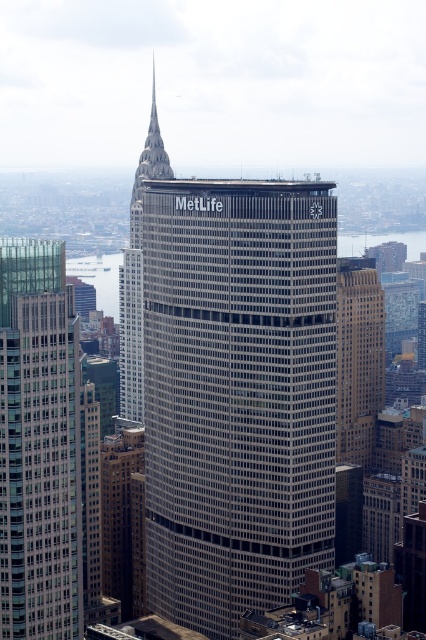
Question: Which object is positioned farthest from the gray glass building at center?

Choices:
 (A) brown stone building at center
 (B) glassy reflective skyscraper at left

Answer: (B)

Question: Does gray glass building at center have a larger size compared to glassy reflective skyscraper at left?

Choices:
 (A) yes
 (B) no

Answer: (A)

Question: Which point is closer to the camera taking this photo?

Choices:
 (A) (51, 244)
 (B) (250, 323)
 (C) (350, 352)

Answer: (B)

Question: Is gray glass building at center closer to the viewer compared to brown stone building at center?

Choices:
 (A) yes
 (B) no

Answer: (A)

Question: Can you confirm if gray glass building at center is thinner than glassy reflective skyscraper at left?

Choices:
 (A) yes
 (B) no

Answer: (B)

Question: Which of the following is the farthest from the observer?

Choices:
 (A) (68, 408)
 (B) (331, 218)
 (C) (350, 314)

Answer: (A)